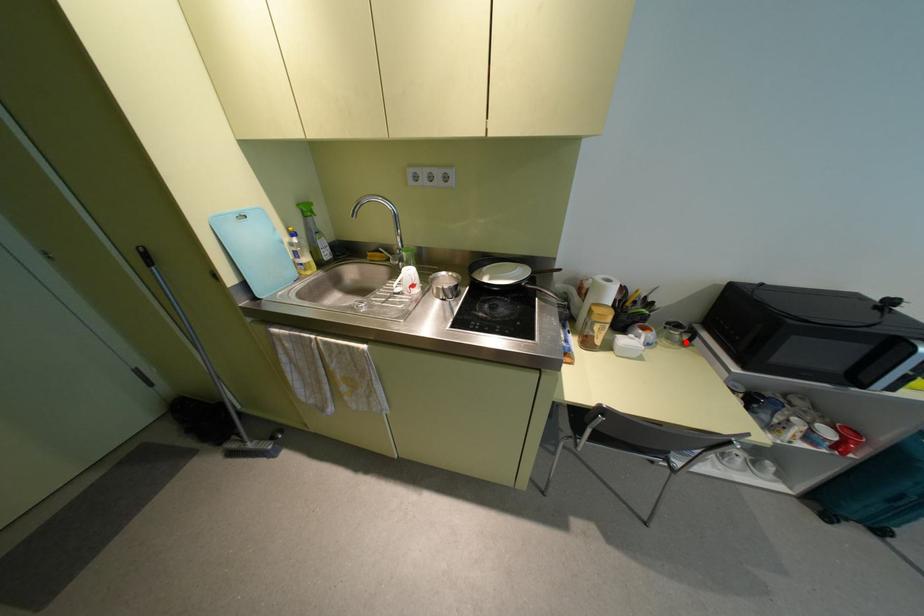
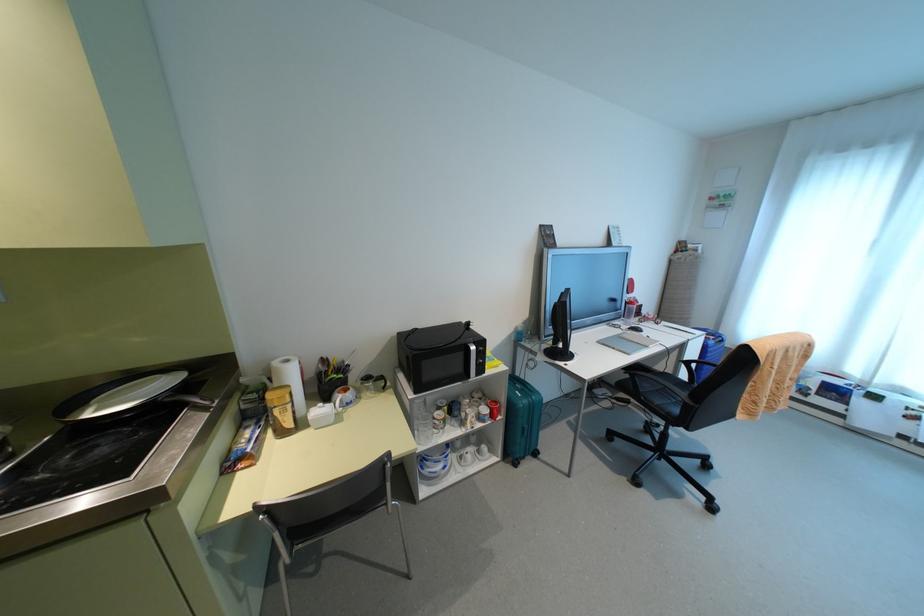
Where in the second image is the point corresponding to the highlighted location from the first image?

(383, 387)